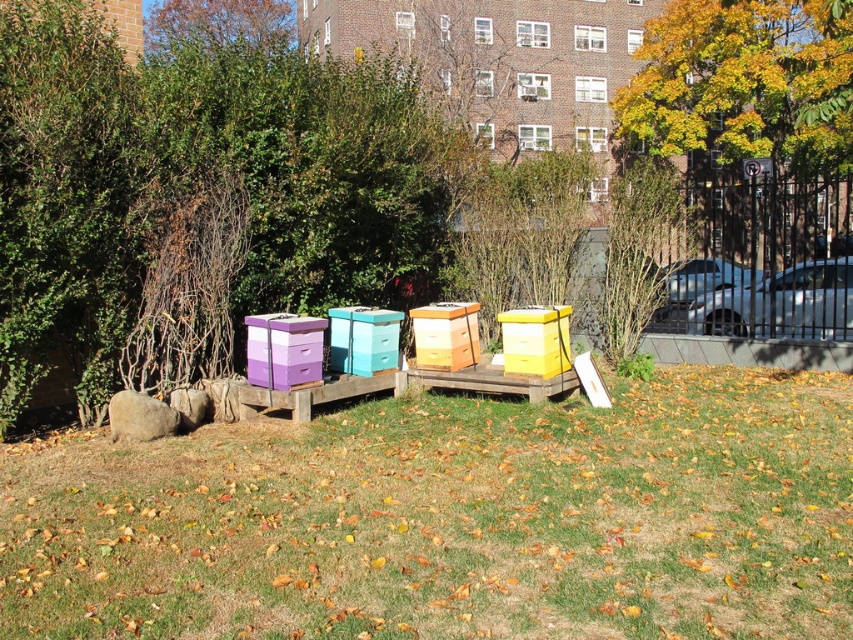
Is point (740, 100) farther from viewer compared to point (544, 349)?

Yes, point (740, 100) is farther from viewer.

Image resolution: width=853 pixels, height=640 pixels. Identify the location of yellow/golden leaves at upper right. (746, 83).

Find the location of a particular element. This screenshot has width=853, height=640. yellow/golden leaves at upper right is located at coordinates (746, 83).

How distant is teal plastic crate at center from wooden beehive at center?

teal plastic crate at center and wooden beehive at center are 21.74 inches apart from each other.

Does point (399, 326) lie behind point (416, 353)?

That is True.

Where is `teal plastic crate at center`? teal plastic crate at center is located at coordinates (363, 339).

Is point (502, 346) positioned behind point (329, 349)?

Yes, point (502, 346) is behind point (329, 349).

Can you confirm if yellow matte beehive at center is positioned to the right of teal plastic crate at center?

Indeed, yellow matte beehive at center is positioned on the right side of teal plastic crate at center.

Is point (566, 348) positioned in front of point (334, 364)?

Yes, it is.

The height and width of the screenshot is (640, 853). What are the coordinates of `yellow matte beehive at center` in the screenshot? It's located at (535, 340).